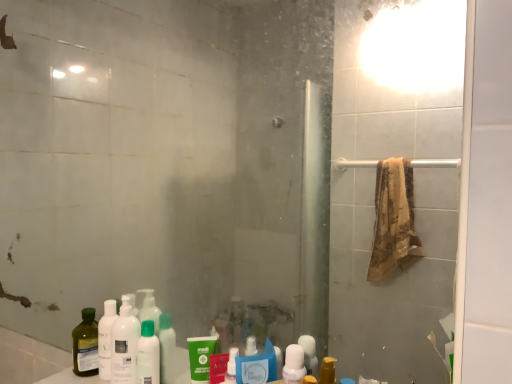
Question: Considering the positions of green matte bottle at center and white plastic bottle at lower center, the 1th mouthwash from the front, in the image, is green matte bottle at center taller or shorter than white plastic bottle at lower center, the 1th mouthwash from the front,?

Choices:
 (A) short
 (B) tall

Answer: (A)

Question: In terms of width, does green matte bottle at center look wider or thinner when compared to white plastic bottle at lower center, marked as the 1th mouthwash in a right-to-left arrangement?

Choices:
 (A) wide
 (B) thin

Answer: (A)

Question: Estimate the real-world distances between objects in this image. Which object is farther from the white plastic bottle at lower center, marked as the 1th mouthwash in a right-to-left arrangement?

Choices:
 (A) green matte tube at lower center, the first mouthwash from the back
 (B) white matte bottle at lower left
 (C) green matte bottle at center

Answer: (B)

Question: Based on their relative distances, which object is nearer to the green matte tube at lower center, the first mouthwash from the left?

Choices:
 (A) white matte bottle at lower left
 (B) green matte bottle at center
 (C) white plastic bottle at lower center, marked as the 1th mouthwash in a right-to-left arrangement

Answer: (B)